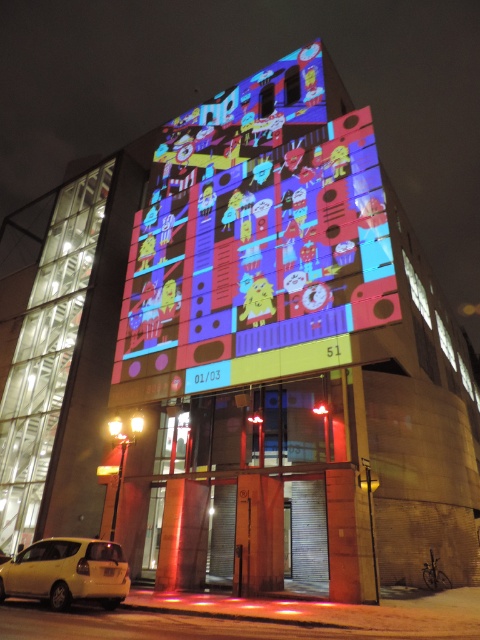
Question: Does colorful digital art at center appear under yellow matte car at lower left?

Choices:
 (A) no
 (B) yes

Answer: (A)

Question: Which point appears closest to the camera in this image?

Choices:
 (A) (84, 576)
 (B) (330, 109)

Answer: (A)

Question: Which of the following is the closest to the observer?

Choices:
 (A) (116, 560)
 (B) (232, 170)

Answer: (A)

Question: Does colorful digital art at center have a larger size compared to yellow matte car at lower left?

Choices:
 (A) no
 (B) yes

Answer: (B)

Question: Can you confirm if colorful digital art at center is positioned above yellow matte car at lower left?

Choices:
 (A) yes
 (B) no

Answer: (A)